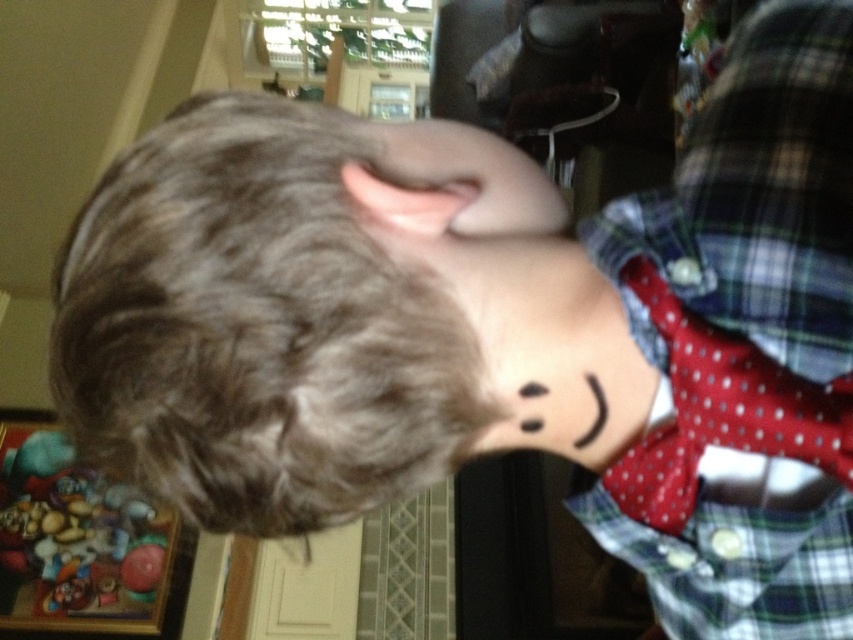
Is brown matte hair at center shorter than black matte neck at center?

Incorrect, brown matte hair at center's height does not fall short of black matte neck at center's.

Between brown matte hair at center and black matte neck at center, which one appears on the right side from the viewer's perspective?

From the viewer's perspective, black matte neck at center appears more on the right side.

Find the location of a particular element. brown matte hair at center is located at coordinates (274, 314).

Can you confirm if brown matte hair at center is taller than smooth plastic toy at lower left?

No, brown matte hair at center is not taller than smooth plastic toy at lower left.

Can you confirm if brown matte hair at center is positioned above smooth plastic toy at lower left?

Correct, brown matte hair at center is located above smooth plastic toy at lower left.

Who is more distant from viewer, [138,204] or [27,456]?

Positioned behind is point [27,456].

At what (x,y) coordinates should I click in order to perform the action: click on brown matte hair at center. Please return your answer as a coordinate pair (x, y). The height and width of the screenshot is (640, 853). Looking at the image, I should click on (274, 314).

Does brown matte hair at center come behind plaid fabric shirt at right?

That is False.

Which is in front, point (490, 221) or point (793, 454)?

Point (793, 454)

Does point (256, 524) come closer to viewer compared to point (720, 268)?

That is False.

This screenshot has height=640, width=853. In order to click on brown matte hair at center in this screenshot , I will do `click(274, 314)`.